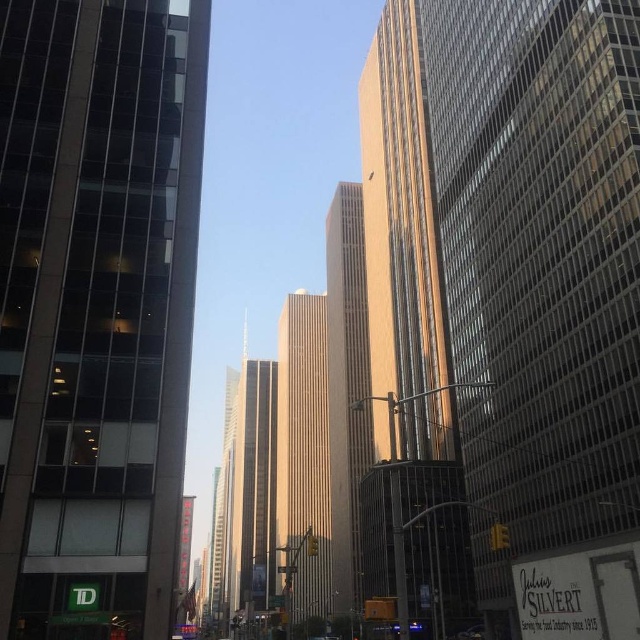
Which is behind, point (200, 141) or point (323, 429)?

The point (323, 429) is more distant.

Can you confirm if glassy reflective building at left is bigger than gold textured building at center?

No.

Measure the distance between point (104, 461) and camera.

Point (104, 461) is 95.29 feet from camera.

Locate an element on the screen. glassy reflective building at left is located at coordinates (96, 308).

Consider the image. Can you confirm if gold reflective glass skyscraper at center is wider than gold textured building at center?

Yes, gold reflective glass skyscraper at center is wider than gold textured building at center.

Is gold reflective glass skyscraper at center smaller than gold textured building at center?

Indeed, gold reflective glass skyscraper at center has a smaller size compared to gold textured building at center.

From the picture: Who is more distant from viewer, (561, 209) or (304, 602)?

The point (304, 602) is more distant.

The height and width of the screenshot is (640, 640). I want to click on gold reflective glass skyscraper at center, so click(508, 304).

Which is in front, point (300, 508) or point (344, 442)?

Point (344, 442) is more forward.

Locate an element on the screen. The image size is (640, 640). gold textured building at center is located at coordinates (304, 458).

Between point (280, 358) and point (348, 513), which one is positioned behind?

Positioned behind is point (280, 358).

At what (x,y) coordinates should I click in order to perform the action: click on gold textured building at center. Please return your answer as a coordinate pair (x, y). The width and height of the screenshot is (640, 640). Looking at the image, I should click on (304, 458).